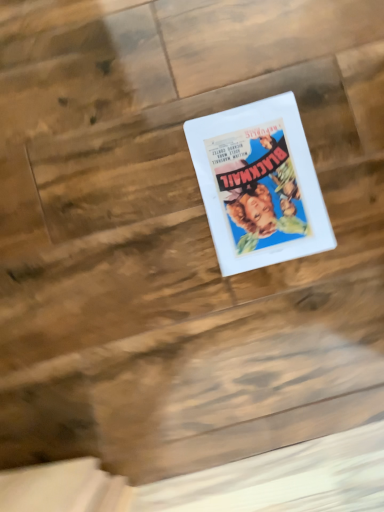
This screenshot has width=384, height=512. Identify the location of free point above white glossy paperback book at center (from a real-world perspective). (262, 186).